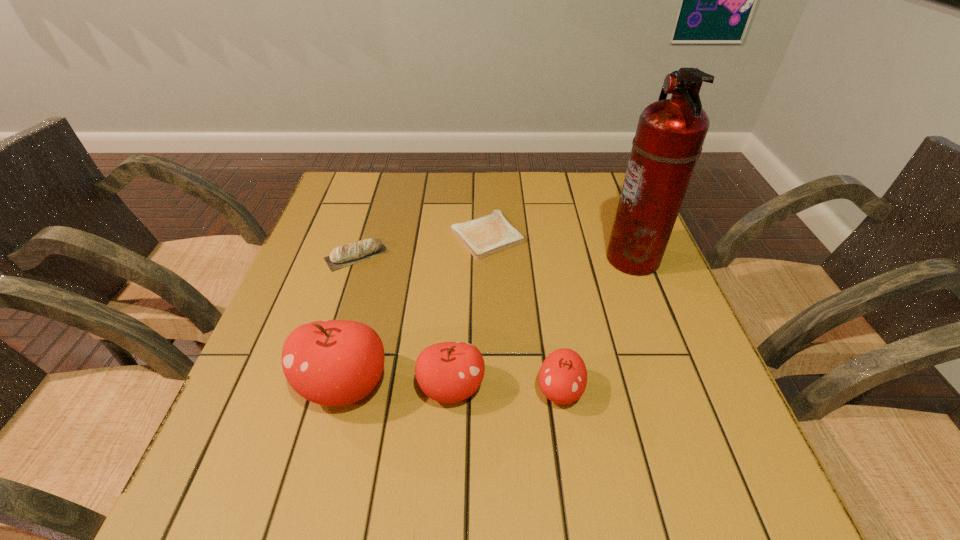
Where is `pita bread that is at the left edge`? The width and height of the screenshot is (960, 540). pita bread that is at the left edge is located at coordinates (341, 256).

In order to click on object present at the right edge in this screenshot , I will do `click(670, 134)`.

Where is `object positioned at the near left corner`? The image size is (960, 540). object positioned at the near left corner is located at coordinates (331, 362).

Find the location of `vacant space at the far edge of the desktop`. vacant space at the far edge of the desktop is located at coordinates (387, 190).

In the image, there is a desktop. Identify the location of vacant space at the near edge. The width and height of the screenshot is (960, 540). (519, 438).

Where is `free space at the left edge of the desktop`? free space at the left edge of the desktop is located at coordinates (319, 256).

Find the location of `vacant space at the right edge of the desktop`. vacant space at the right edge of the desktop is located at coordinates (659, 326).

This screenshot has height=540, width=960. What are the coordinates of `blank space at the far left corner of the desktop` in the screenshot? It's located at (340, 207).

Identify the location of free space at the near left corner of the desktop. (277, 407).

Locate an element on the screen. This screenshot has height=540, width=960. free area in between the leftmost apple and the third tallest object is located at coordinates (398, 387).